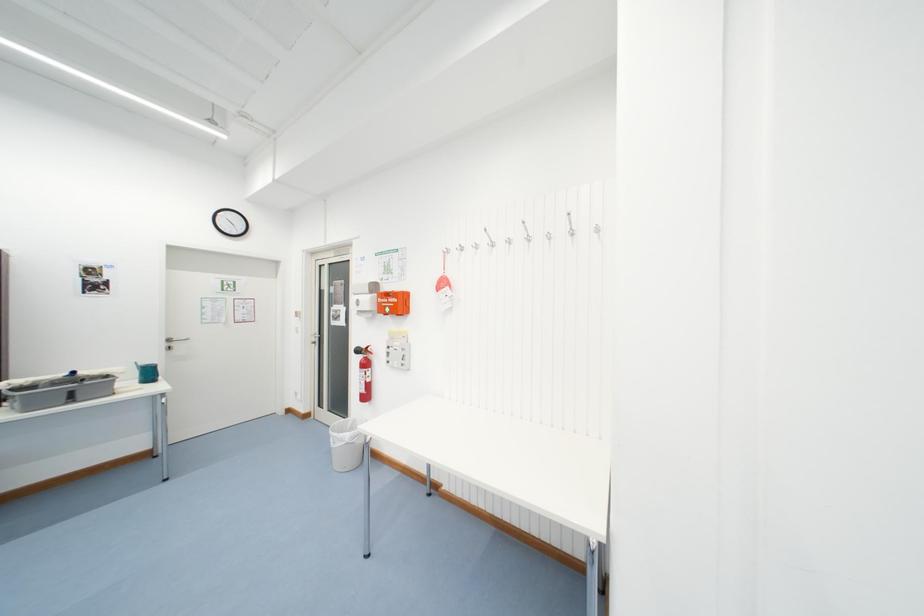
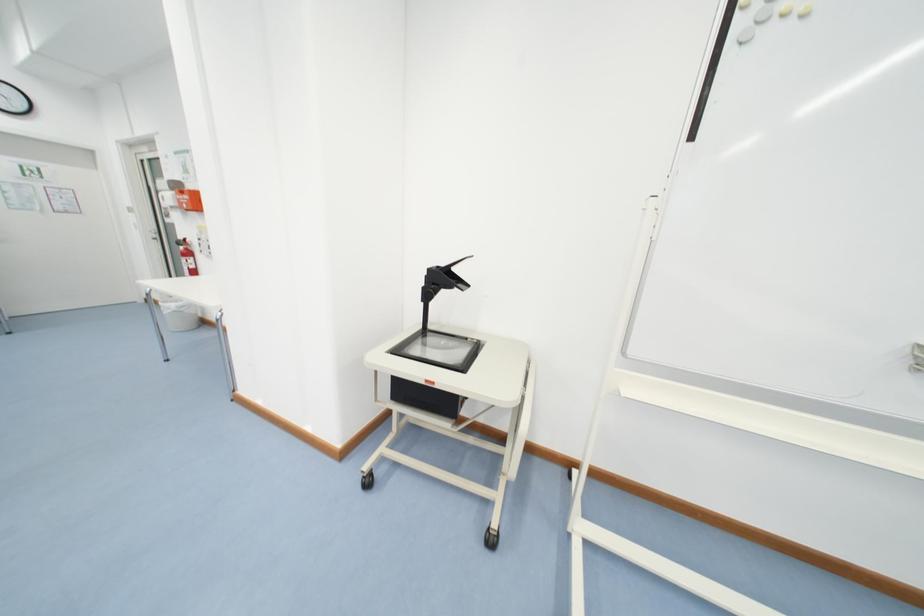
What movement of the cameraman would produce the second image?

The cameraman walked toward right, backward.